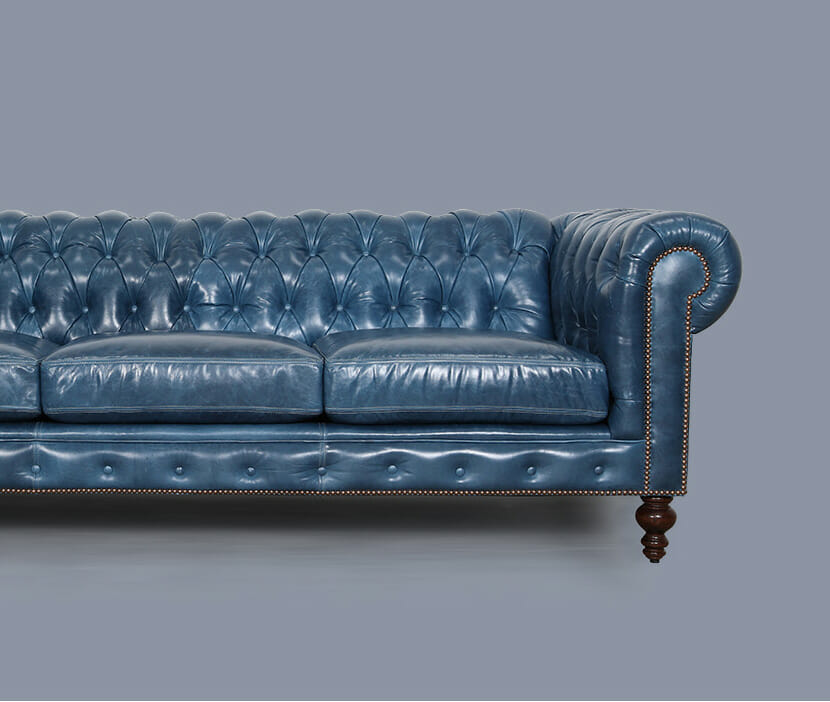
The height and width of the screenshot is (702, 830). I want to click on couch cushions, so click(404, 399), click(164, 390).